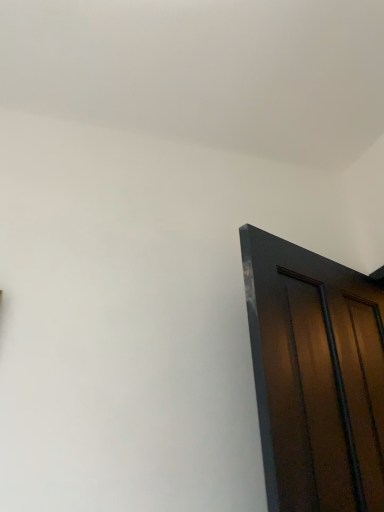
What do you see at coordinates (315, 376) in the screenshot? The image size is (384, 512). I see `dark wood door at right` at bounding box center [315, 376].

Locate an element on the screen. The height and width of the screenshot is (512, 384). dark wood door at right is located at coordinates (315, 376).

This screenshot has width=384, height=512. In order to click on dark wood door at right in this screenshot , I will do `click(315, 376)`.